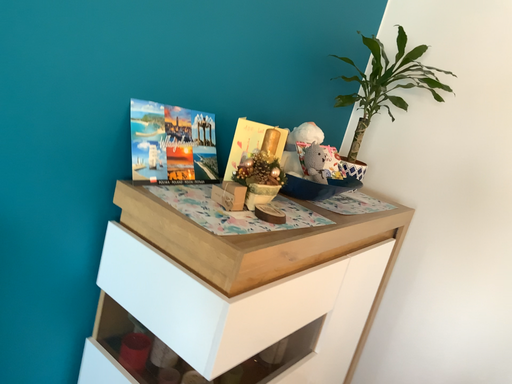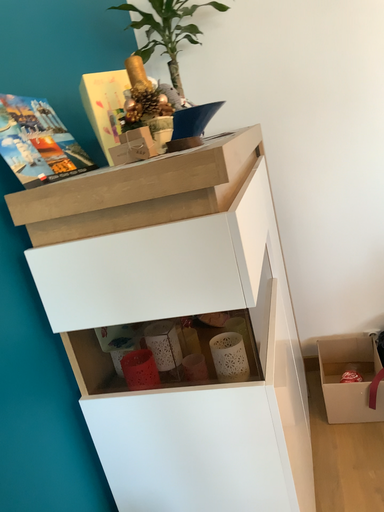
Question: How did the camera likely rotate when shooting the video?

Choices:
 (A) rotated left
 (B) rotated right

Answer: (B)